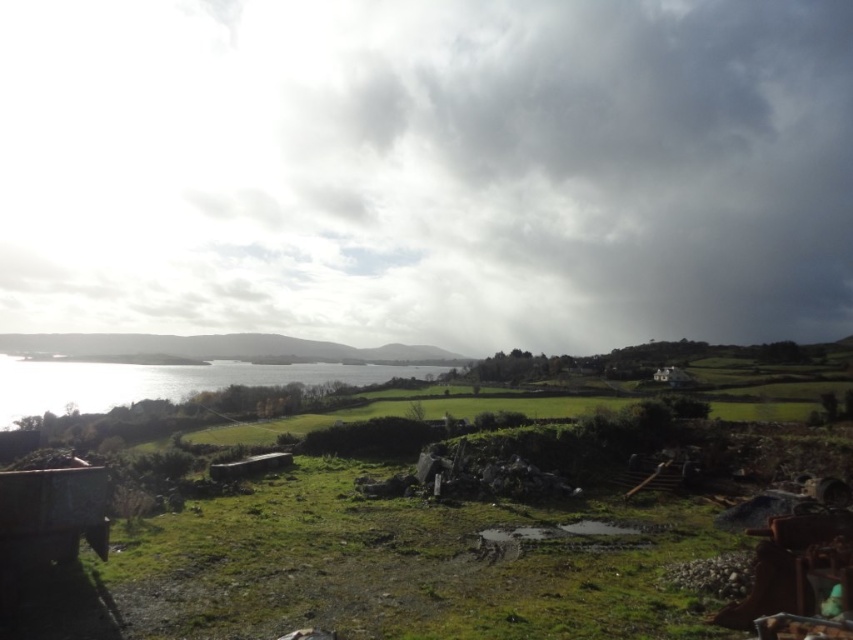
Can you confirm if cloudy sky at upper center is smaller than shiny silver water at left?

Actually, cloudy sky at upper center might be larger than shiny silver water at left.

Which is more to the right, cloudy sky at upper center or shiny silver water at left?

From the viewer's perspective, cloudy sky at upper center appears more on the right side.

At what (x,y) coordinates should I click in order to perform the action: click on cloudy sky at upper center. Please return your answer as a coordinate pair (x, y). Looking at the image, I should click on (428, 170).

Identify the location of cloudy sky at upper center. (428, 170).

Is cloudy sky at upper center to the left of green grassy hillside at lower center from the viewer's perspective?

In fact, cloudy sky at upper center is to the right of green grassy hillside at lower center.

Which is in front, point (225, 118) or point (10, 339)?

Point (10, 339)

At what (x,y) coordinates should I click in order to perform the action: click on cloudy sky at upper center. Please return your answer as a coordinate pair (x, y). Looking at the image, I should click on (428, 170).

Does point (70, 385) come behind point (352, 348)?

No, (70, 385) is closer to viewer.

The height and width of the screenshot is (640, 853). Find the location of `shiny silver water at left`. shiny silver water at left is located at coordinates (160, 381).

Is point (331, 364) behind point (91, 333)?

No, it is in front of (91, 333).

Where is `shiny silver water at left`? The height and width of the screenshot is (640, 853). shiny silver water at left is located at coordinates (160, 381).